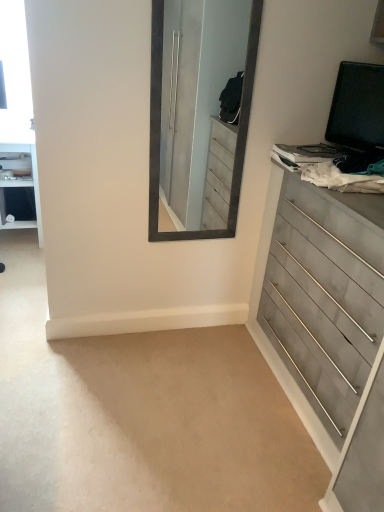
The height and width of the screenshot is (512, 384). What do you see at coordinates (20, 177) in the screenshot?
I see `white glossy vanity at left` at bounding box center [20, 177].

Identify the location of white glossy vanity at left. Image resolution: width=384 pixels, height=512 pixels. (20, 177).

Measure the distance between gray wood dresser at right and camera.

The distance of gray wood dresser at right from camera is 1.12 meters.

This screenshot has width=384, height=512. I want to click on gray wood dresser at right, so click(x=327, y=325).

What do you see at coordinates (327, 325) in the screenshot? The width and height of the screenshot is (384, 512). I see `gray wood dresser at right` at bounding box center [327, 325].

What is the approximate height of gray wood dresser at right?

36.55 inches.

Locate an element on the screen. Image resolution: width=384 pixels, height=512 pixels. white glossy vanity at left is located at coordinates (20, 177).

Between white glossy vanity at left and gray wood dresser at right, which one appears on the left side from the viewer's perspective?

From the viewer's perspective, white glossy vanity at left appears more on the left side.

Considering the positions of objects white glossy vanity at left and gray wood dresser at right in the image provided, who is behind, white glossy vanity at left or gray wood dresser at right?

white glossy vanity at left is more distant.

Which is in front, point (17, 145) or point (307, 206)?

The point (307, 206) is closer to the camera.

From the image's perspective, between white glossy vanity at left and gray wood dresser at right, who is located below?

gray wood dresser at right is shown below in the image.

From a real-world perspective, is white glossy vanity at left positioned over gray wood dresser at right based on gravity?

Incorrect, from a real-world perspective, white glossy vanity at left is lower than gray wood dresser at right.

Considering the sizes of white glossy vanity at left and gray wood dresser at right in the image, is white glossy vanity at left wider or thinner than gray wood dresser at right?

Considering their sizes, white glossy vanity at left looks broader than gray wood dresser at right.

Between white glossy vanity at left and gray wood dresser at right, which one has more height?

With more height is gray wood dresser at right.

Looking at this image, does white glossy vanity at left have a smaller size compared to gray wood dresser at right?

Yes, white glossy vanity at left is smaller than gray wood dresser at right.

Can we say white glossy vanity at left lies outside gray wood dresser at right?

Absolutely, white glossy vanity at left is external to gray wood dresser at right.

Is white glossy vanity at left next to gray wood dresser at right and touching it?

No, white glossy vanity at left is not next to gray wood dresser at right.

Is white glossy vanity at left facing towards gray wood dresser at right?

No, white glossy vanity at left is not facing towards gray wood dresser at right.

How distant is white glossy vanity at left from gray wood dresser at right?

The distance of white glossy vanity at left from gray wood dresser at right is 6.52 feet.

You are a GUI agent. You are given a task and a screenshot of the screen. Output one action in this format:
    pyautogui.click(x=<x>, y=<y>)
    Task: Click on the vanity that is on the left side of gray wood dresser at right
    The image size is (384, 512).
    Given the screenshot: What is the action you would take?
    pyautogui.click(x=20, y=177)

In the image, is gray wood dresser at right on the left side or the right side of white glossy vanity at left?

From the image, it's evident that gray wood dresser at right is to the right of white glossy vanity at left.

Considering their positions, is gray wood dresser at right located in front of or behind white glossy vanity at left?

gray wood dresser at right is positioned closer to the viewer than white glossy vanity at left.

Between point (302, 195) and point (34, 169), which one is positioned behind?

The point (34, 169) is farther from the camera.

Based on the photo, from the image's perspective, which one is positioned lower, gray wood dresser at right or white glossy vanity at left?

gray wood dresser at right, from the image's perspective.

From a real-world perspective, who is located higher, gray wood dresser at right or white glossy vanity at left?

gray wood dresser at right is physically above.

Which of these two, gray wood dresser at right or white glossy vanity at left, is wider?

white glossy vanity at left.

Can you confirm if gray wood dresser at right is shorter than white glossy vanity at left?

No, gray wood dresser at right is not shorter than white glossy vanity at left.

Considering the sizes of objects gray wood dresser at right and white glossy vanity at left in the image provided, who is smaller, gray wood dresser at right or white glossy vanity at left?

white glossy vanity at left is smaller.

Is gray wood dresser at right completely or partially outside of white glossy vanity at left?

gray wood dresser at right is positioned outside white glossy vanity at left.

Is gray wood dresser at right positioned far away from white glossy vanity at left?

Yes, gray wood dresser at right and white glossy vanity at left are quite far apart.

Is gray wood dresser at right aimed at white glossy vanity at left?

No, gray wood dresser at right is not facing towards white glossy vanity at left.

Can you tell me how much gray wood dresser at right and white glossy vanity at left differ in facing direction?

There is a 90.1-degree angle between the facing directions of gray wood dresser at right and white glossy vanity at left.

How much distance is there between gray wood dresser at right and white glossy vanity at left?

A distance of 1.99 meters exists between gray wood dresser at right and white glossy vanity at left.

Image resolution: width=384 pixels, height=512 pixels. Identify the location of the chest of drawers located below the white glossy vanity at left (from the image's perspective). (327, 325).

There is a white glossy vanity at left. Where is `the chest of drawers above it (from a real-world perspective)`? Image resolution: width=384 pixels, height=512 pixels. the chest of drawers above it (from a real-world perspective) is located at coordinates (327, 325).

Where is `vanity above the gray wood dresser at right (from the image's perspective)`? Image resolution: width=384 pixels, height=512 pixels. vanity above the gray wood dresser at right (from the image's perspective) is located at coordinates (20, 177).